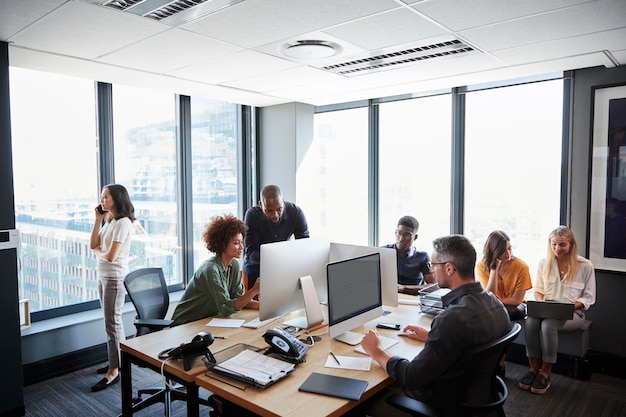
Find the location of a particular element. The height and width of the screenshot is (417, 626). floor to ceiling window panes is located at coordinates (498, 124), (422, 125), (347, 152), (217, 143), (141, 155), (62, 155).